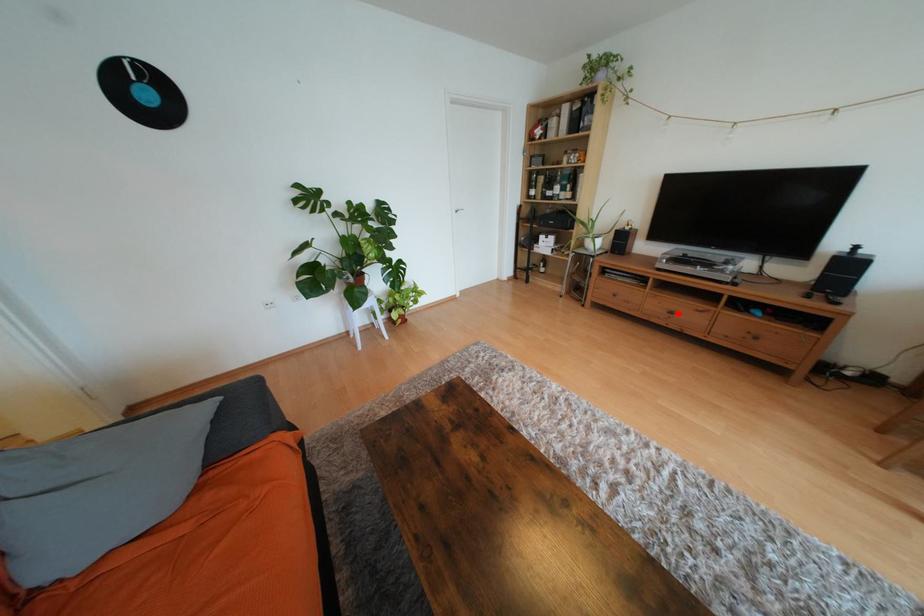
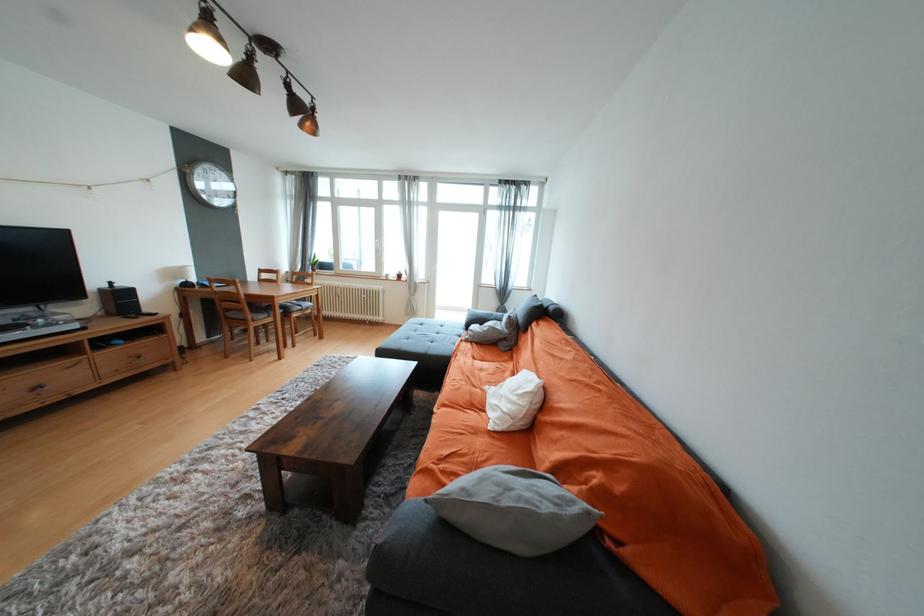
The point at the highlighted location is marked in the first image. Where is the corresponding point in the second image?

(44, 387)